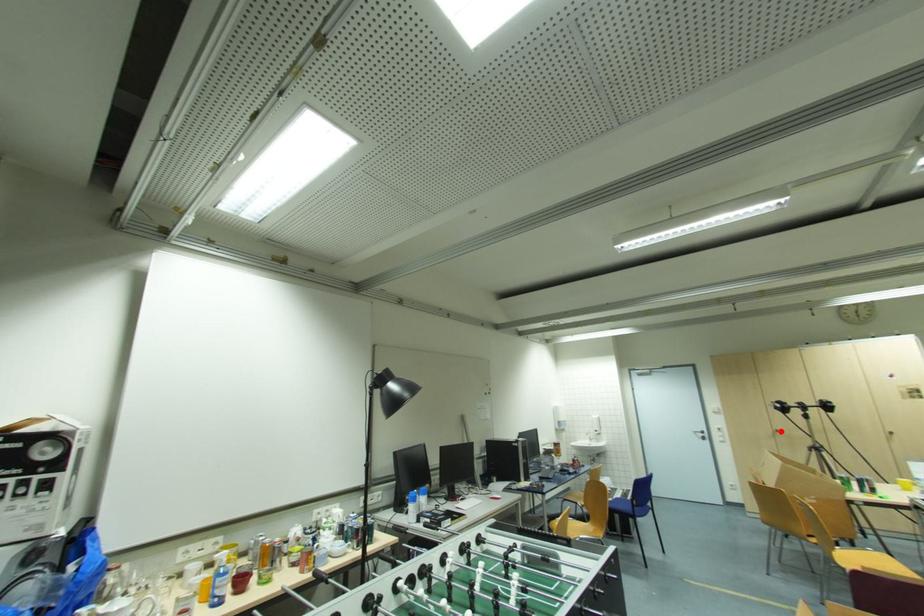
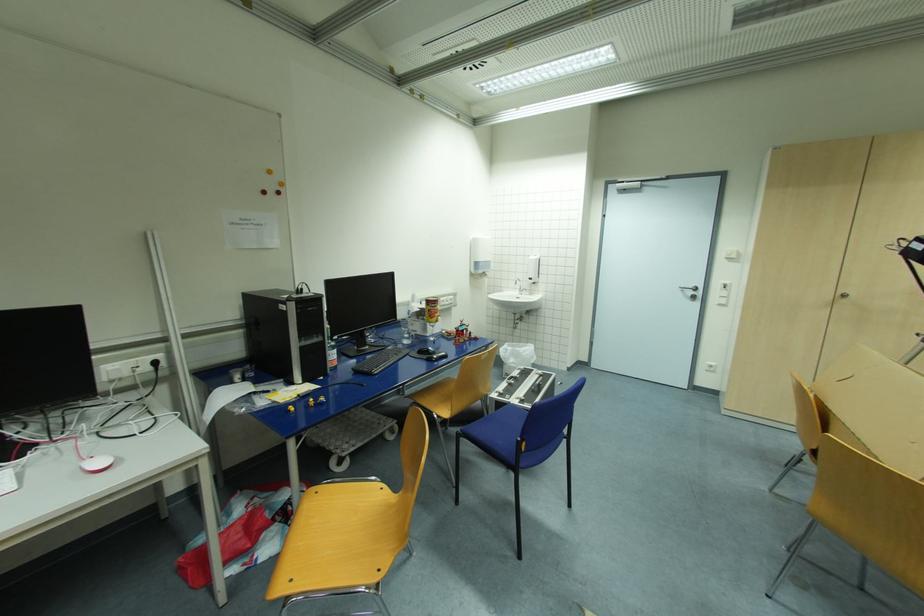
Question: I am providing you with two images of the same scene from different viewpoints. In image1, a red point is highlighted. Considering the same 3D point in image2, which of the following is correct?

Choices:
 (A) It is closer
 (B) It is farther

Answer: (B)